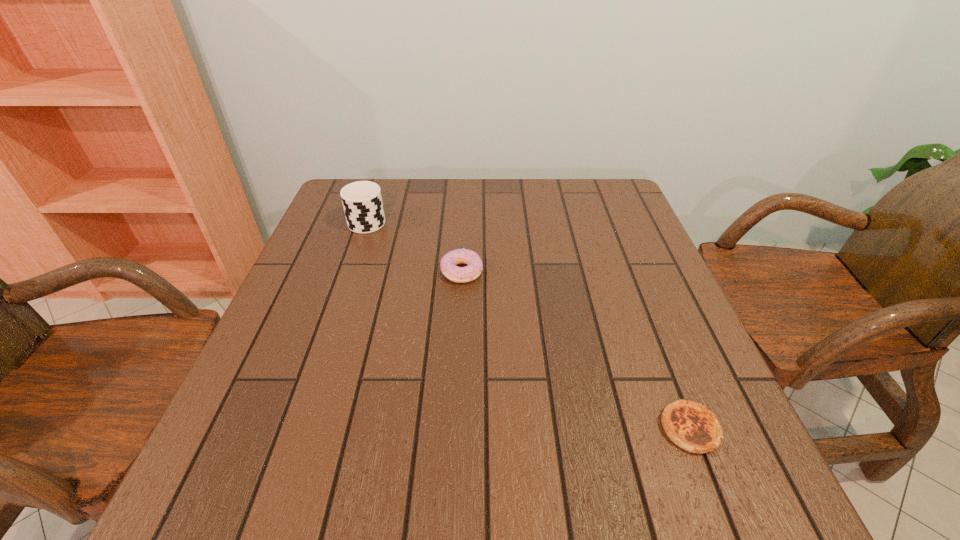
Image resolution: width=960 pixels, height=540 pixels. Find the location of `free spot located on the front of the rightmost object`. free spot located on the front of the rightmost object is located at coordinates (715, 494).

You are a GUI agent. You are given a task and a screenshot of the screen. Output one action in this format:
    pyautogui.click(x=<x>, y=<y>)
    Task: Click on the object positioned at the far edge
    
    Given the screenshot: What is the action you would take?
    pyautogui.click(x=362, y=201)

Find the location of `object at the left edge`. object at the left edge is located at coordinates (362, 201).

This screenshot has width=960, height=540. What are the coordinates of `object present at the right edge` in the screenshot? It's located at (690, 425).

This screenshot has width=960, height=540. In order to click on object at the far left corner in this screenshot , I will do `click(362, 201)`.

Identify the location of vacant space at the far edge. (500, 193).

Where is `free space at the left edge`? This screenshot has width=960, height=540. free space at the left edge is located at coordinates (220, 446).

This screenshot has height=540, width=960. Identify the location of free space at the right edge. (614, 321).

Locate an element on the screen. The height and width of the screenshot is (540, 960). free region at the near left corner of the desktop is located at coordinates (213, 500).

This screenshot has height=540, width=960. Find the location of `blank space at the far right corner`. blank space at the far right corner is located at coordinates (601, 186).